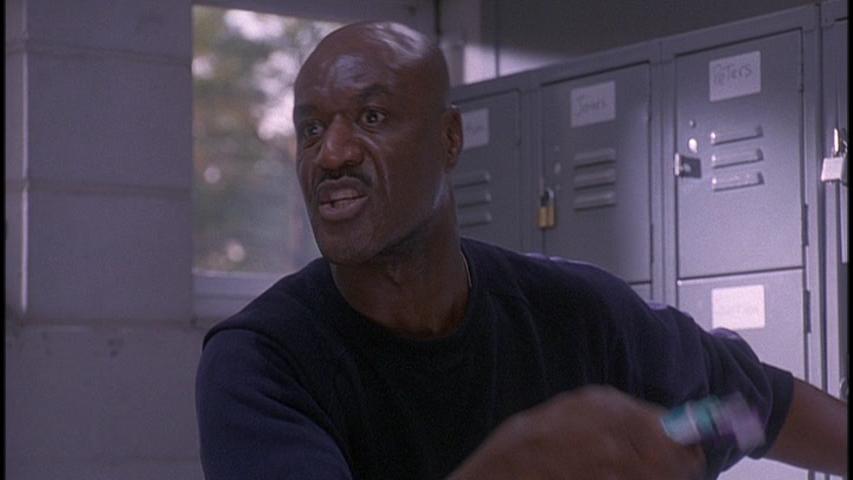
What are the coordinates of `window` in the screenshot? It's located at (209, 217).